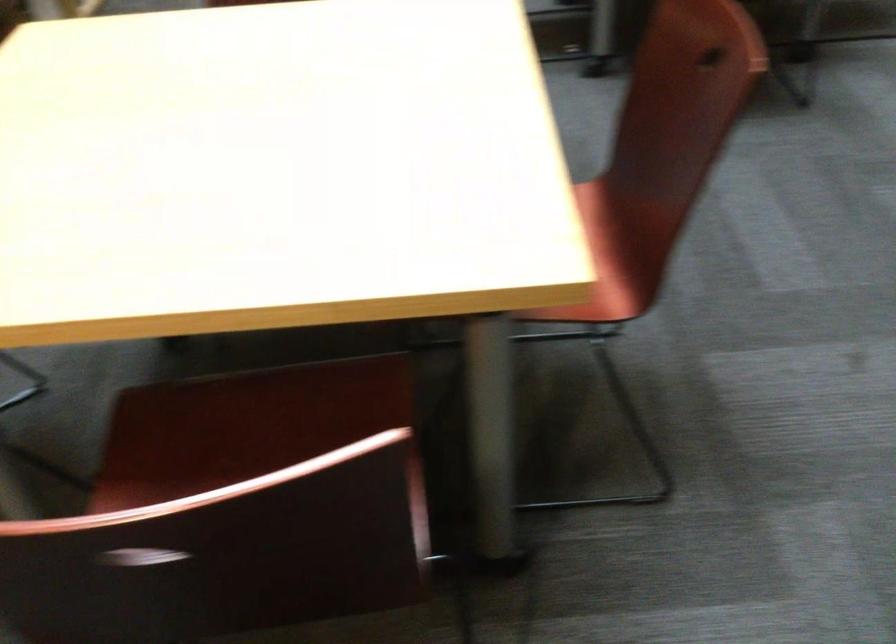
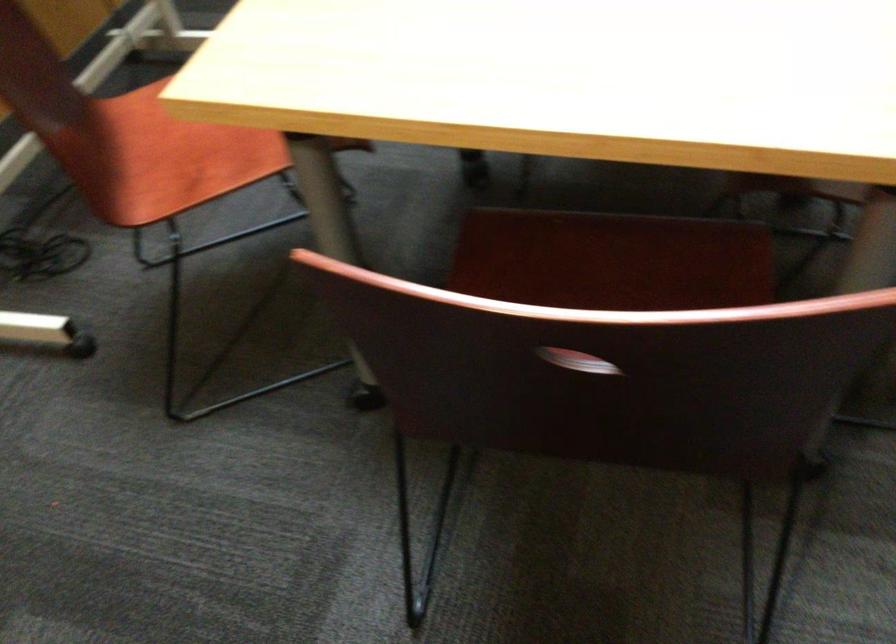
Locate, in the second image, the point that corresponds to (x=271, y=413) in the first image.

(612, 261)